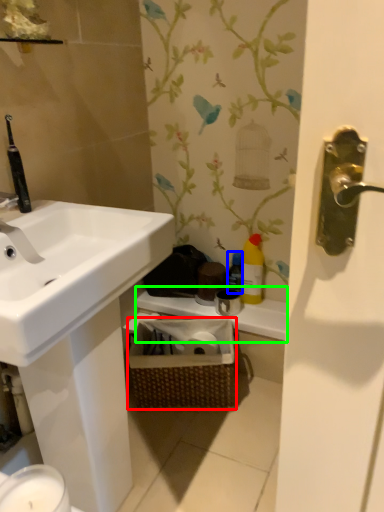
Question: Which object is the farthest from basket (highlighted by a red box)? Choose among these: bottle (highlighted by a blue box) or counter top (highlighted by a green box).

Choices:
 (A) bottle
 (B) counter top

Answer: (A)